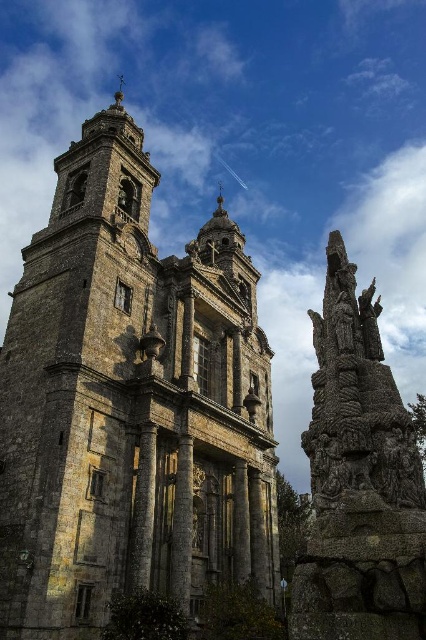
Question: Does stone tower at center appear under rustic stone sculpture at right?

Choices:
 (A) yes
 (B) no

Answer: (B)

Question: Which point appears closest to the camera in this image?

Choices:
 (A) (334, 280)
 (B) (100, 353)

Answer: (A)

Question: Among these points, which one is farthest from the camera?

Choices:
 (A) (58, 593)
 (B) (388, 486)

Answer: (A)

Question: Is stone tower at center further to camera compared to rustic stone sculpture at right?

Choices:
 (A) yes
 (B) no

Answer: (A)

Question: Does stone tower at center have a greater width compared to rustic stone sculpture at right?

Choices:
 (A) no
 (B) yes

Answer: (B)